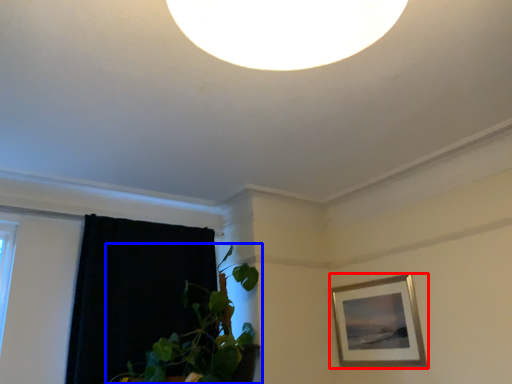
Question: Which point is further to the camera, picture frame (highlighted by a red box) or houseplant (highlighted by a blue box)?

Choices:
 (A) picture frame
 (B) houseplant

Answer: (A)